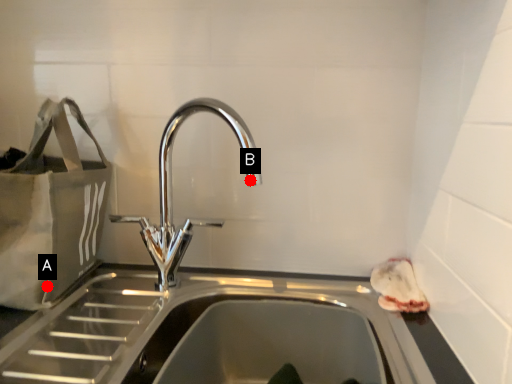
Question: Two points are circled on the image, labeled by A and B beside each circle. Which of the following is the closest to the observer?

Choices:
 (A) A is closer
 (B) B is closer

Answer: (A)